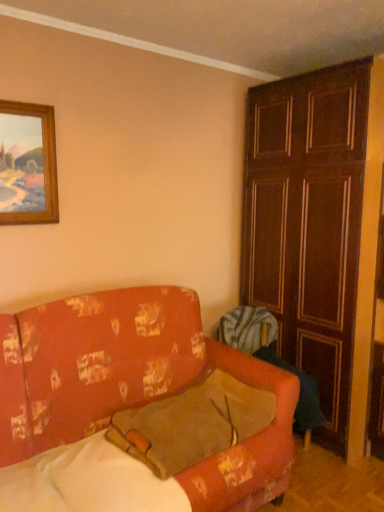
Question: Is floral-patterned fabric couch at lower left at the right side of wooden panelled door at right?

Choices:
 (A) no
 (B) yes

Answer: (A)

Question: Is the depth of floral-patterned fabric couch at lower left less than that of wooden panelled door at right?

Choices:
 (A) yes
 (B) no

Answer: (A)

Question: From the image's perspective, is floral-patterned fabric couch at lower left on wooden panelled door at right?

Choices:
 (A) yes
 (B) no

Answer: (B)

Question: Does floral-patterned fabric couch at lower left have a lesser height compared to wooden panelled door at right?

Choices:
 (A) no
 (B) yes

Answer: (B)

Question: Could you tell me if floral-patterned fabric couch at lower left is facing wooden panelled door at right?

Choices:
 (A) yes
 (B) no

Answer: (B)

Question: From their relative heights in the image, would you say wooden panelled door at right is taller or shorter than brown suede pillow at center?

Choices:
 (A) short
 (B) tall

Answer: (B)

Question: Is wooden panelled door at right inside or outside of brown suede pillow at center?

Choices:
 (A) outside
 (B) inside

Answer: (A)

Question: Based on their sizes in the image, would you say wooden panelled door at right is bigger or smaller than brown suede pillow at center?

Choices:
 (A) big
 (B) small

Answer: (A)

Question: Relative to brown suede pillow at center, is wooden panelled door at right in front or behind?

Choices:
 (A) behind
 (B) front

Answer: (A)

Question: From a real-world perspective, is floral-patterned fabric couch at lower left above or below wooden panelled door at right?

Choices:
 (A) below
 (B) above

Answer: (A)

Question: Is floral-patterned fabric couch at lower left in front of or behind wooden panelled door at right in the image?

Choices:
 (A) front
 (B) behind

Answer: (A)

Question: Is floral-patterned fabric couch at lower left inside the boundaries of wooden panelled door at right, or outside?

Choices:
 (A) inside
 (B) outside

Answer: (B)

Question: Does point (29, 359) appear closer or farther from the camera than point (321, 240)?

Choices:
 (A) closer
 (B) farther

Answer: (A)

Question: Considering the positions of point (345, 245) and point (14, 144), is point (345, 245) closer or farther from the camera than point (14, 144)?

Choices:
 (A) closer
 (B) farther

Answer: (B)

Question: In the image, is wooden panelled door at right positioned in front of or behind wooden picture frame at upper left?

Choices:
 (A) behind
 (B) front

Answer: (A)